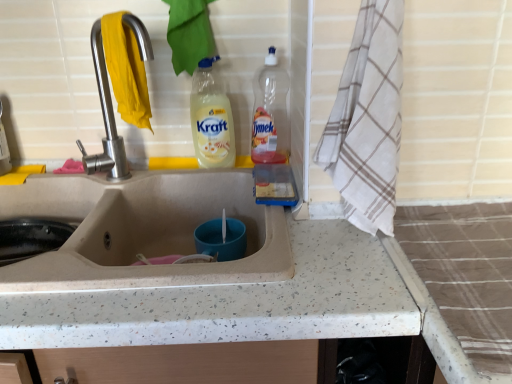
Question: Is white checkered towel at right at the right side of translucent plastic bottle at upper right, placed as the first bottle when sorted from right to left?

Choices:
 (A) yes
 (B) no

Answer: (A)

Question: Is white checkered towel at right touching translucent plastic bottle at upper right, which ranks as the 2th bottle in left-to-right order?

Choices:
 (A) no
 (B) yes

Answer: (A)

Question: Does white checkered towel at right turn towards translucent plastic bottle at upper right, placed as the first bottle when sorted from right to left?

Choices:
 (A) no
 (B) yes

Answer: (A)

Question: Is white checkered towel at right wider than translucent plastic bottle at upper right, which ranks as the 2th bottle in left-to-right order?

Choices:
 (A) no
 (B) yes

Answer: (B)

Question: Does white checkered towel at right have a smaller size compared to translucent plastic bottle at upper right, placed as the first bottle when sorted from right to left?

Choices:
 (A) yes
 (B) no

Answer: (B)

Question: Would you say beige speckled sink at center is inside or outside satin nickel faucet at upper left?

Choices:
 (A) outside
 (B) inside

Answer: (A)

Question: Would you say beige speckled sink at center is to the left or to the right of satin nickel faucet at upper left in the picture?

Choices:
 (A) right
 (B) left

Answer: (B)

Question: Considering the positions of beige speckled sink at center and satin nickel faucet at upper left in the image, is beige speckled sink at center bigger or smaller than satin nickel faucet at upper left?

Choices:
 (A) small
 (B) big

Answer: (B)

Question: From a real-world perspective, is beige speckled sink at center above or below satin nickel faucet at upper left?

Choices:
 (A) above
 (B) below

Answer: (B)

Question: From the image's perspective, relative to satin nickel faucet at upper left, is yellow translucent bottle at upper center, the second bottle in the right-to-left sequence, above or below?

Choices:
 (A) below
 (B) above

Answer: (A)

Question: Do you think yellow translucent bottle at upper center, the second bottle in the right-to-left sequence, is within satin nickel faucet at upper left, or outside of it?

Choices:
 (A) outside
 (B) inside

Answer: (A)

Question: Is yellow translucent bottle at upper center, acting as the 1th bottle starting from the left, bigger or smaller than satin nickel faucet at upper left?

Choices:
 (A) big
 (B) small

Answer: (A)

Question: Is yellow translucent bottle at upper center, the second bottle in the right-to-left sequence, wider or thinner than satin nickel faucet at upper left?

Choices:
 (A) thin
 (B) wide

Answer: (B)

Question: Based on their sizes in the image, would you say white checkered towel at right is bigger or smaller than beige speckled sink at center?

Choices:
 (A) small
 (B) big

Answer: (A)

Question: From a real-world perspective, is white checkered towel at right positioned above or below beige speckled sink at center?

Choices:
 (A) below
 (B) above

Answer: (B)